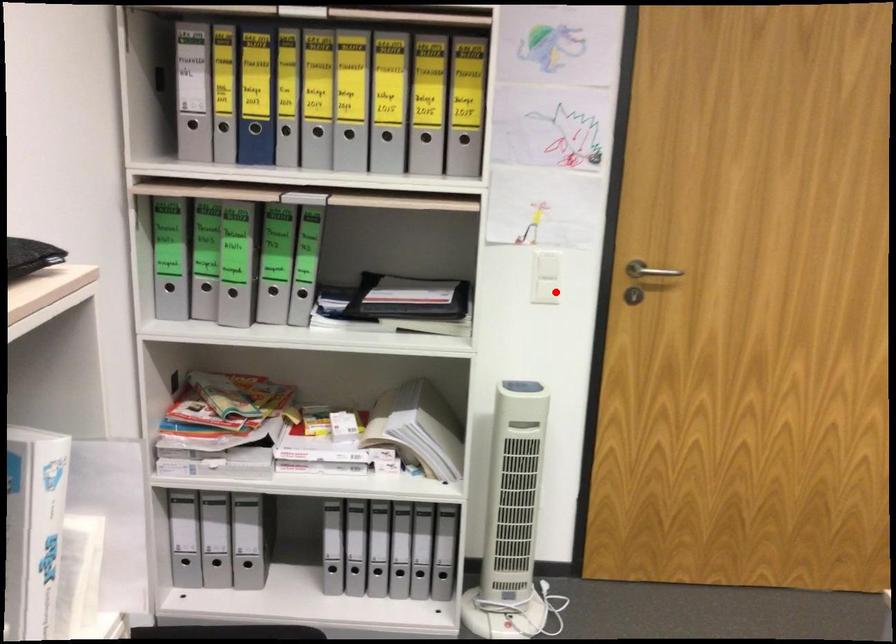
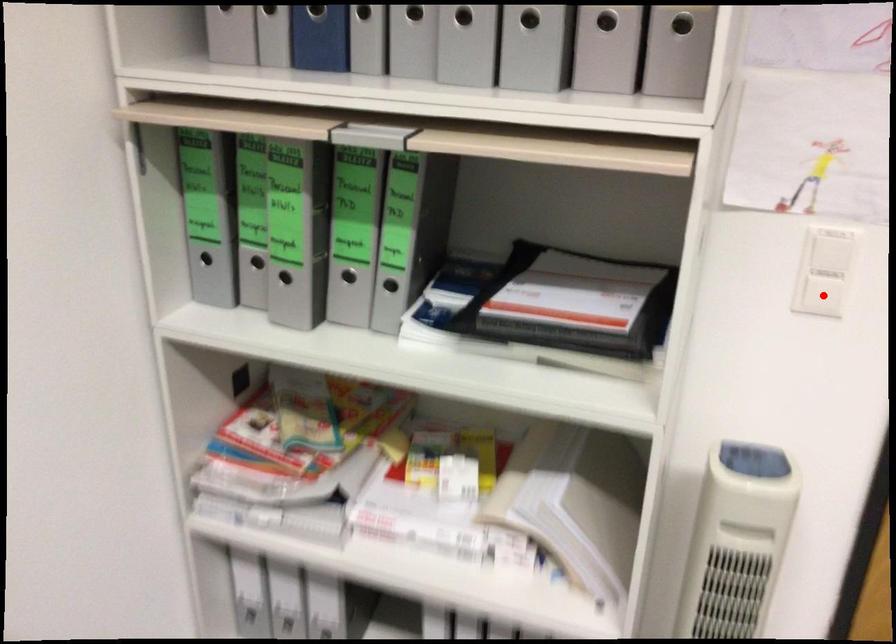
I am providing you with two images of the same scene from different viewpoints. A red point is marked on the first image and another point is marked on the second image. Is the marked point in image1 the same physical position as the marked point in image2?

Yes